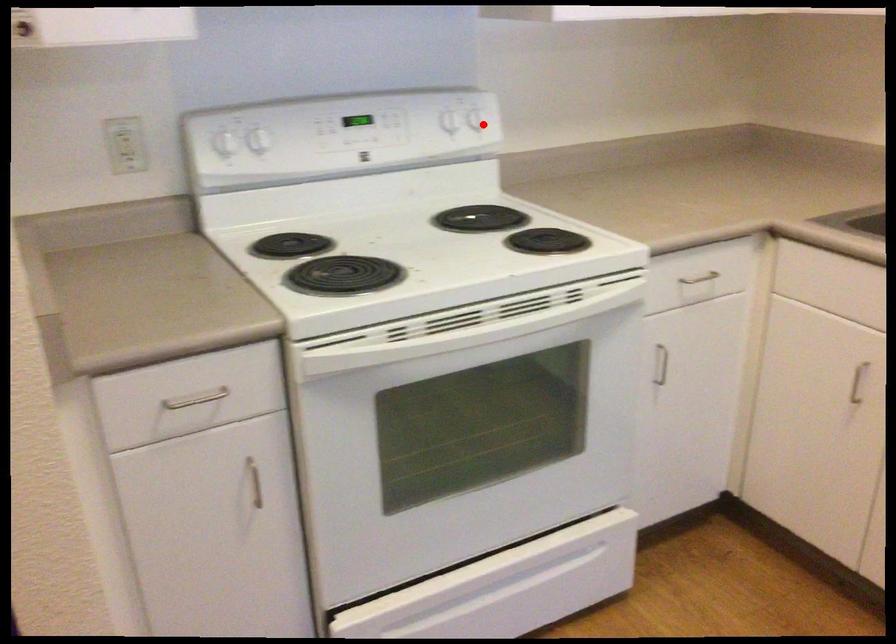
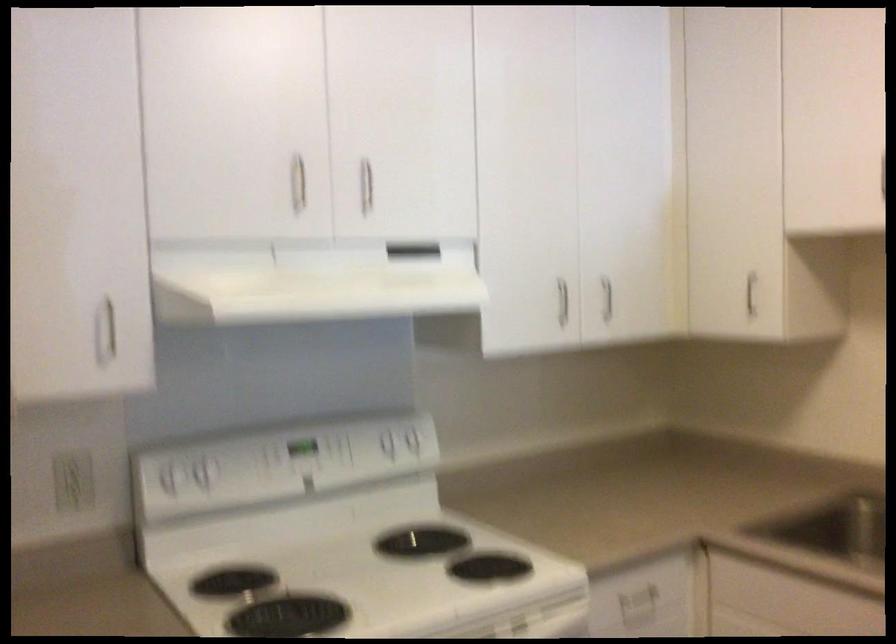
Locate, in the second image, the point that corresponds to the highlighted location in the first image.

(419, 444)